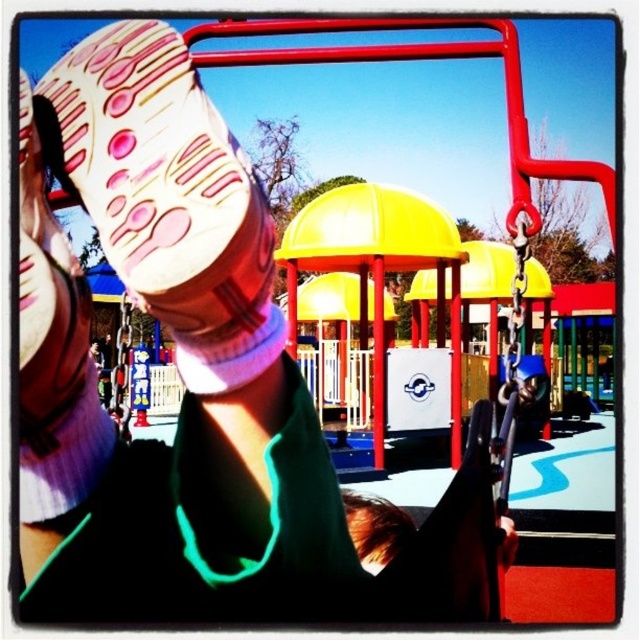
Measure the distance between pink fabric sock at upper left and camera.

They are 18.39 inches apart.

Which is in front, point (102, 116) or point (349, 520)?

Positioned in front is point (102, 116).

Who is more distant from viewer, (164, 81) or (348, 497)?

Point (348, 497)

At what (x,y) coordinates should I click in order to perform the action: click on pink fabric sock at upper left. Please return your answer as a coordinate pair (x, y). This screenshot has width=640, height=640. Looking at the image, I should click on (170, 198).